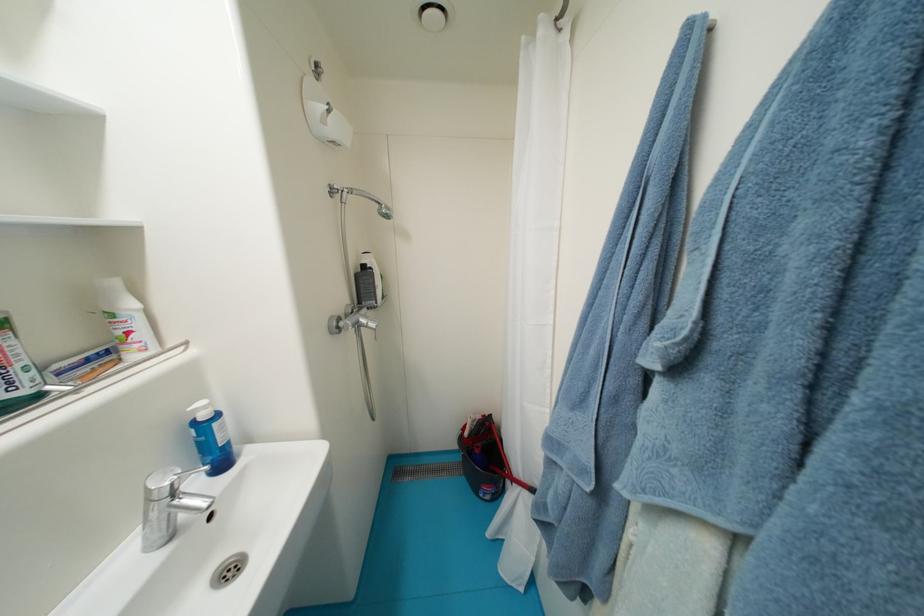
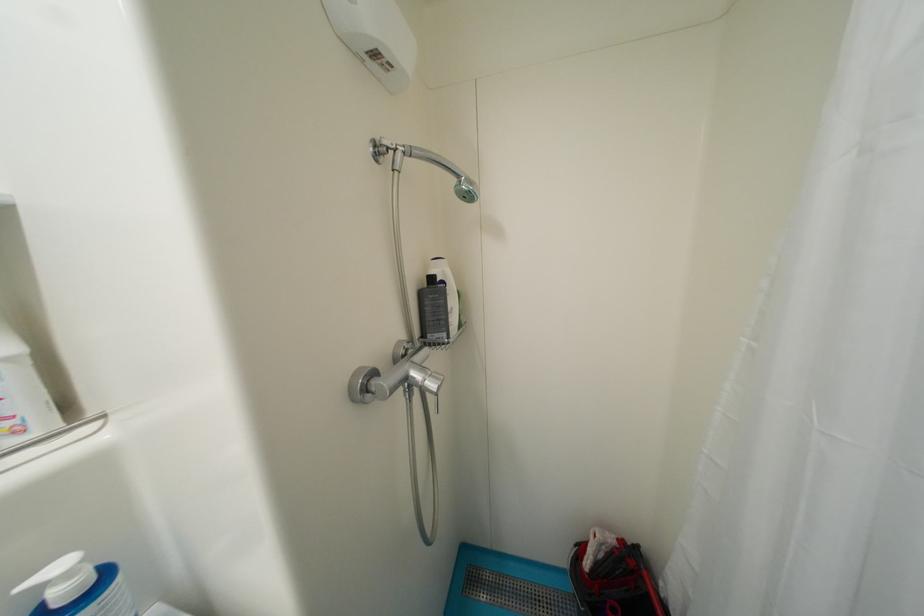
The point at (371, 269) is marked in the first image. Where is the corresponding point in the second image?

(439, 281)